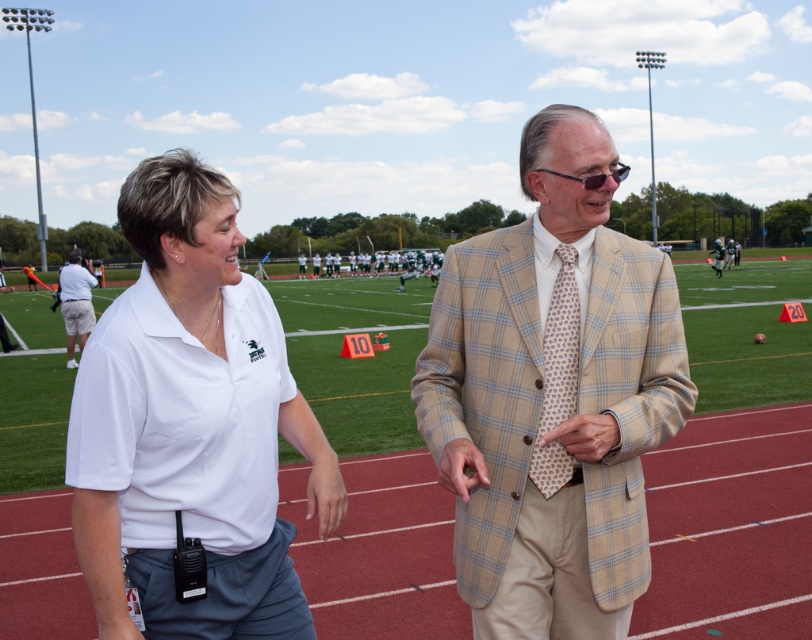
In the scene shown: You are standing at the edge of the sports field and want to reach the point marked as point (549, 316). If your stride length is 2.6 feet per step, how many steps will it take you to reach that point?

The distance between you and point (549, 316) is 7.80 feet. Since each step covers 2.6 feet, dividing 7.80 by 2.6 gives exactly 3 steps. Therefore, it will take you 3 steps to reach point (549, 316).

You are a photographer positioned at the back of the sports field. You need to capture a photo where the white cotton polo shirt at center and khaki shorts at left are both visible. Based on their positions, which object should you ensure is on the left side of your frame to include both?

To include both the white cotton polo shirt at center and khaki shorts at left in the photo, you should ensure the khaki shorts at left is on the left side of your frame since the white cotton polo shirt at center is to the right of it.